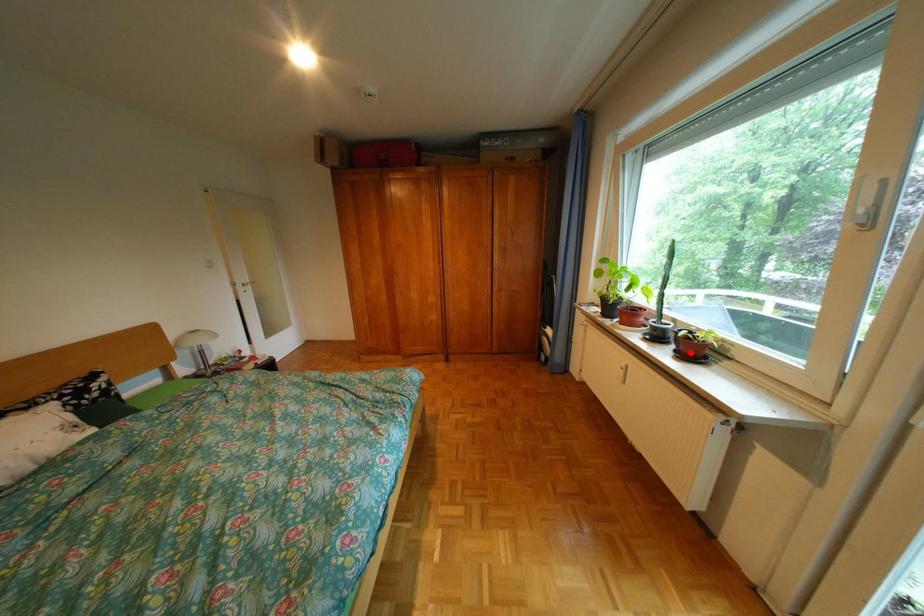
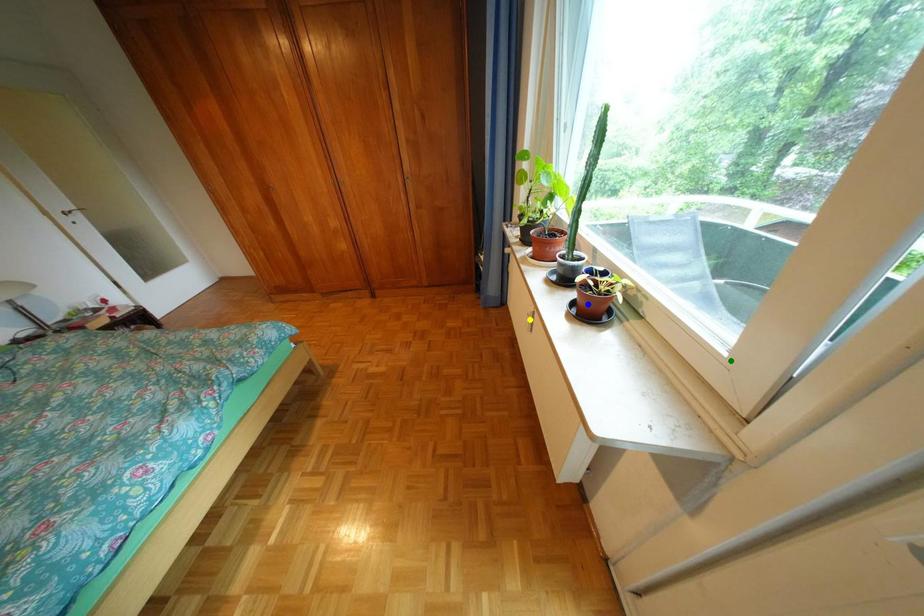
Question: I am providing you with two images of the same scene from different viewpoints. A red point is marked on the first image. You are given multiple points on the second image. Which point in image 2 represents the same 3d spot as the red point in image 1?

Choices:
 (A) green point
 (B) yellow point
 (C) blue point

Answer: (C)